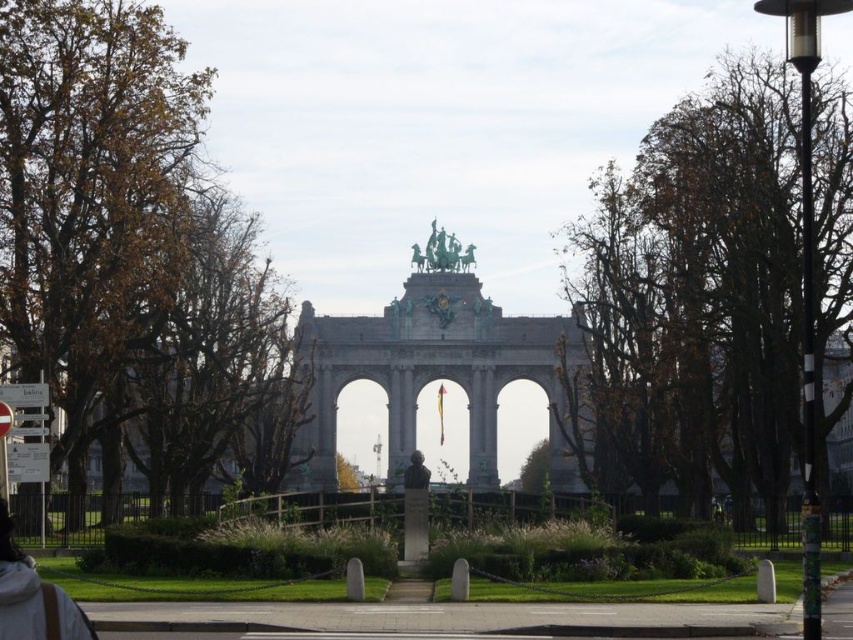
You are standing in the park and see the brown leafy tree at left and the bronze bust at center. Which object is closer to the entrance of the monument?

The bronze bust at center is closer to the entrance of the monument because the brown leafy tree at left is positioned on the left side of bronze bust at center, placing the bust nearer to the central structure.

You are standing in the park and want to take a photo of the bronze bust at center. However, the brown leafy tree at left is blocking your view. Can you move to a different position to avoid the tree?

The brown leafy tree at left is in front of the bronze bust at center, so moving to the side or behind the bronze bust at center should provide an unobstructed view.